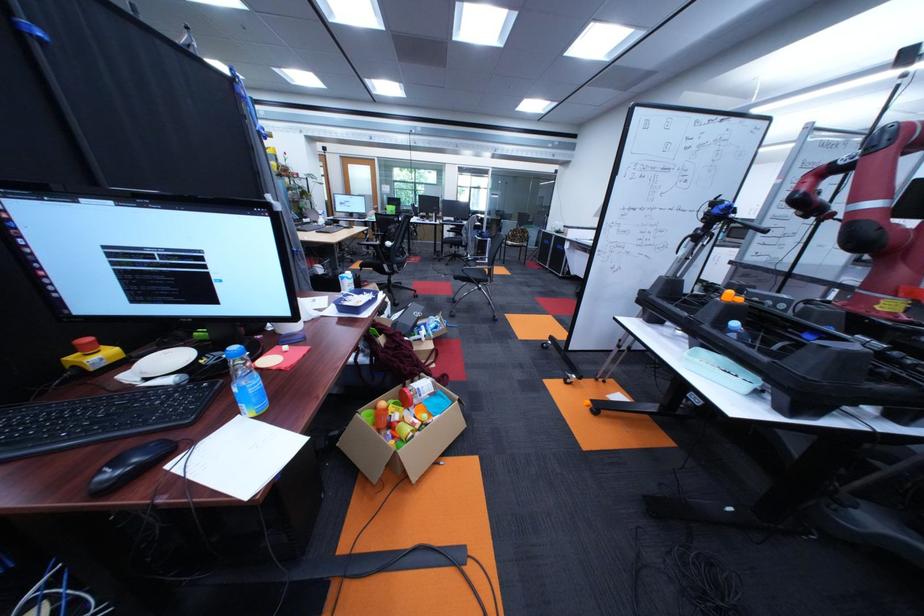
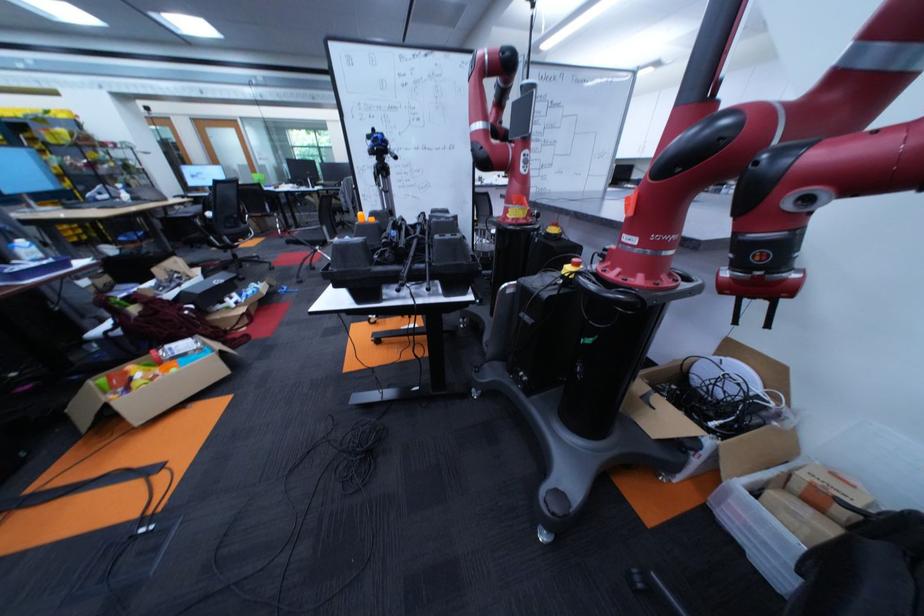
Locate, in the second image, the point that corresponds to (399,411) in the first image.

(140, 371)